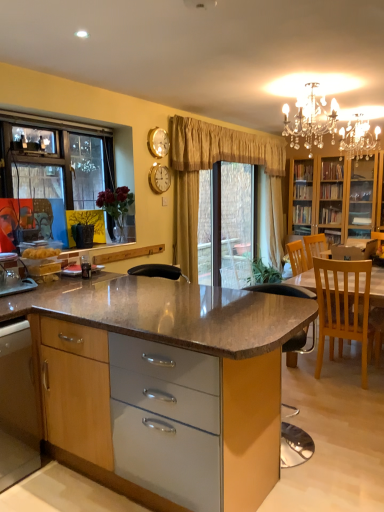
Question: Does wooden/textured cabinet at center, positioned as the 2th cabinetry in left-to-right order, have a smaller size compared to gold metallic clock at upper center?

Choices:
 (A) no
 (B) yes

Answer: (A)

Question: Does wooden/textured cabinet at center, positioned as the 2th cabinetry in left-to-right order, come in front of gold metallic clock at upper center?

Choices:
 (A) yes
 (B) no

Answer: (A)

Question: Does wooden/textured cabinet at center, the first cabinetry from the right, appear on the right side of gold metallic clock at upper center?

Choices:
 (A) no
 (B) yes

Answer: (B)

Question: Does wooden/textured cabinet at center, the first cabinetry from the right, have a greater height compared to gold metallic clock at upper center?

Choices:
 (A) yes
 (B) no

Answer: (A)

Question: Does wooden/textured cabinet at center, the first cabinetry from the right, contain gold metallic clock at upper center?

Choices:
 (A) no
 (B) yes

Answer: (A)

Question: Is the surface of wooden/textured cabinet at center, positioned as the 2th cabinetry in left-to-right order, in direct contact with gold metallic clock at upper center?

Choices:
 (A) no
 (B) yes

Answer: (A)

Question: Is wooden/textured cabinet at center, positioned as the 2th cabinetry in left-to-right order, facing away from light wood chair at right?

Choices:
 (A) no
 (B) yes

Answer: (B)

Question: Is wooden/textured cabinet at center, the first cabinetry from the right, bigger than light wood chair at right?

Choices:
 (A) no
 (B) yes

Answer: (B)

Question: Is light wood chair at right a part of wooden/textured cabinet at center, positioned as the 2th cabinetry in left-to-right order?

Choices:
 (A) yes
 (B) no

Answer: (B)

Question: From a real-world perspective, is wooden/textured cabinet at center, the first cabinetry from the right, located beneath light wood chair at right?

Choices:
 (A) yes
 (B) no

Answer: (A)

Question: Considering the relative positions of wooden/textured cabinet at center, the first cabinetry from the right, and light wood chair at right in the image provided, is wooden/textured cabinet at center, the first cabinetry from the right, to the left of light wood chair at right from the viewer's perspective?

Choices:
 (A) no
 (B) yes

Answer: (B)

Question: Can you confirm if wooden/textured cabinet at center, the first cabinetry from the right, is positioned to the right of light wood chair at right?

Choices:
 (A) no
 (B) yes

Answer: (A)

Question: Is wooden cabinet at lower left, acting as the 1th cabinetry starting from the left, shorter than light wood chair at right?

Choices:
 (A) no
 (B) yes

Answer: (B)